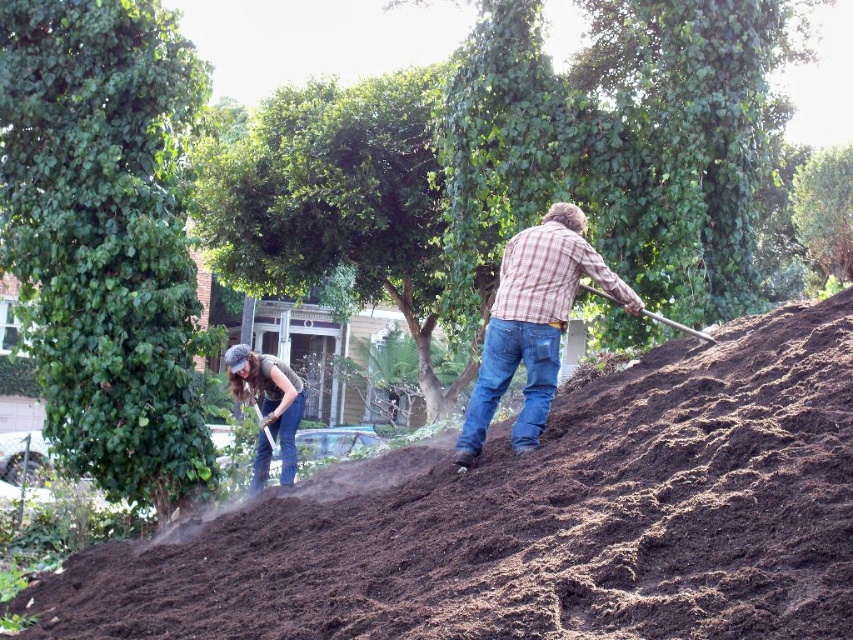
You are standing at the center of the garden and want to reach the dark brown soil at center. Which direction should you move to get there?

The dark brown soil at center is already at your current position since you are standing at the center of the garden.

You are a gardener who wants to place a small plant pot on the plaid flannel shirt at upper center. Can you do this without disturbing the dark brown soil at center?

The dark brown soil at center is below the plaid flannel shirt at upper center, so placing the pot on the shirt would not disturb the soil.